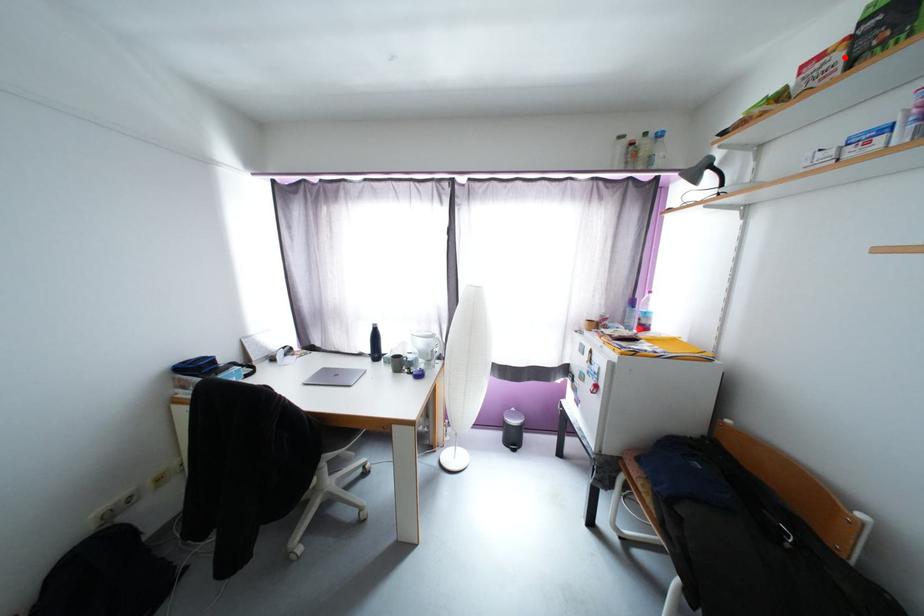
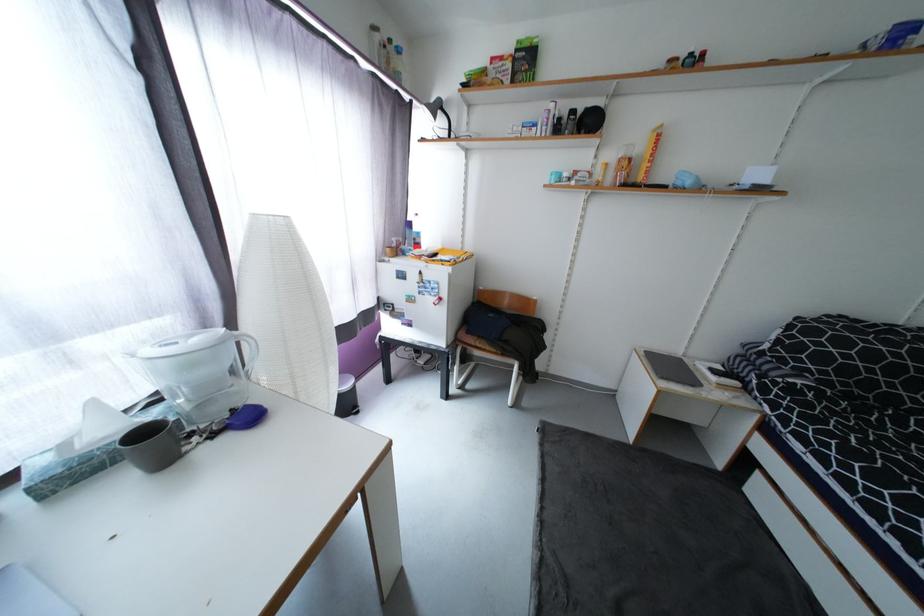
Find the pixel in the second image that matches the highlighted location in the first image.

(515, 66)